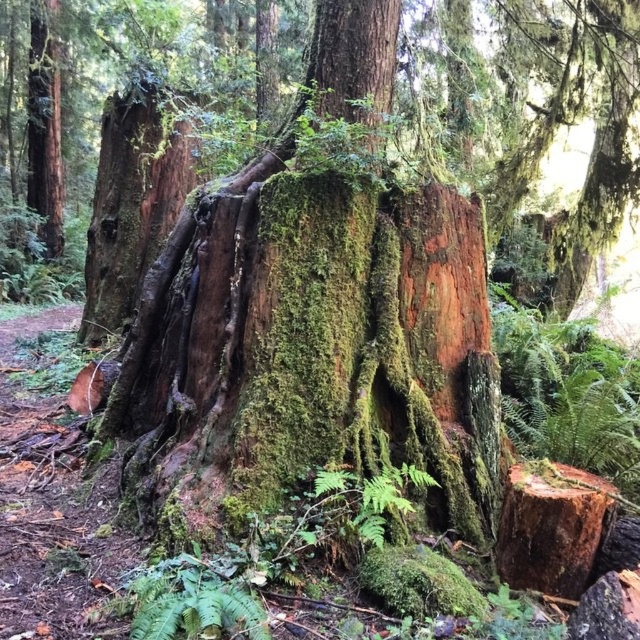
Does green mossy stump at center have a greater width compared to smooth brown tree trunk at upper left?

Incorrect, green mossy stump at center's width does not surpass smooth brown tree trunk at upper left's.

Can you confirm if green mossy stump at center is taller than smooth brown tree trunk at upper left?

Incorrect, green mossy stump at center's height is not larger of smooth brown tree trunk at upper left's.

What do you see at coordinates (552, 528) in the screenshot?
I see `green mossy stump at center` at bounding box center [552, 528].

Identify the location of green mossy stump at center. pos(552,528).

Does green mossy stump at center have a lesser width compared to green mossy fern at center?

Correct, green mossy stump at center's width is less than green mossy fern at center's.

Is green mossy stump at center wider than green mossy fern at center?

Incorrect, green mossy stump at center's width does not surpass green mossy fern at center's.

Between point (580, 522) and point (380, 544), which one is positioned behind?

The point (580, 522) is behind.

The image size is (640, 640). Find the location of `green mossy stump at center`. green mossy stump at center is located at coordinates (552, 528).

Is smooth brown tree trunk at upper left smaller than green mossy fern at center?

Actually, smooth brown tree trunk at upper left might be larger than green mossy fern at center.

Is point (38, 10) positioned in front of point (372, 515)?

No, (38, 10) is further to viewer.

Describe the element at coordinates (44, 124) in the screenshot. I see `smooth brown tree trunk at upper left` at that location.

In order to click on smooth brown tree trunk at upper left in this screenshot , I will do `click(44, 124)`.